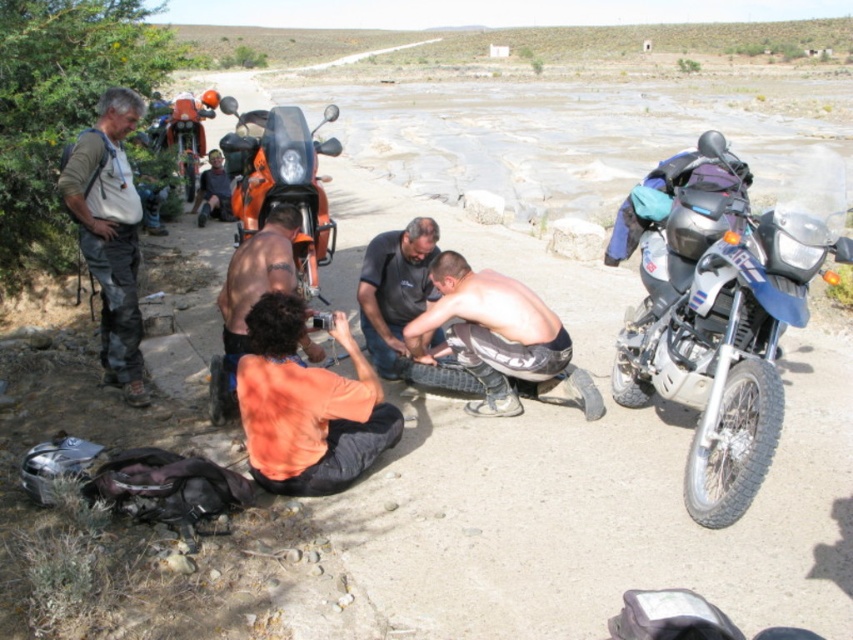
Which of these two, black rubber tire at lower right or orange fabric shirt at center, stands shorter?

With less height is black rubber tire at lower right.

Is point (764, 467) closer to viewer compared to point (206, 218)?

That is True.

Find the location of a particular element. black rubber tire at lower right is located at coordinates (733, 444).

Is shiny black tire at center to the left of dark blue shirt at center from the viewer's perspective?

In fact, shiny black tire at center is to the right of dark blue shirt at center.

Between point (570, 342) and point (399, 273), which one is positioned behind?

The point (399, 273) is more distant.

The width and height of the screenshot is (853, 640). Identify the location of shiny black tire at center. click(498, 339).

Describe the element at coordinates (726, 314) in the screenshot. This screenshot has height=640, width=853. I see `blue metallic motorcycle at center` at that location.

In the scene shown: Between blue metallic motorcycle at center and green fabric backpack at left, which one appears on the left side from the viewer's perspective?

green fabric backpack at left

Between point (770, 259) and point (74, 172), which one is positioned in front?

Positioned in front is point (770, 259).

Find the location of a particular element. The width and height of the screenshot is (853, 640). blue metallic motorcycle at center is located at coordinates (726, 314).